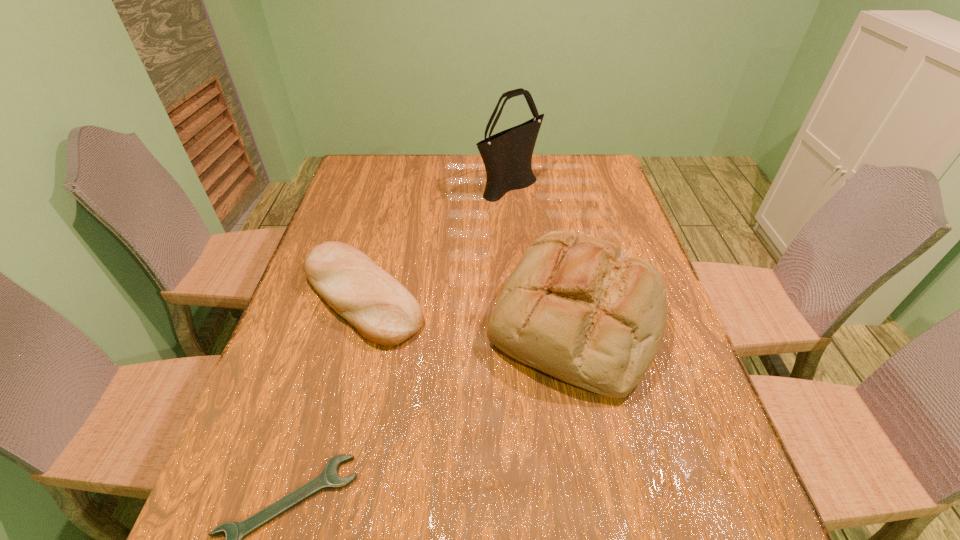
Image resolution: width=960 pixels, height=540 pixels. I want to click on object at the left edge, so click(x=384, y=312).

Where is `object at the right edge`? object at the right edge is located at coordinates (576, 307).

In the image, there is a desktop. Where is `vacant space at the far edge`? The height and width of the screenshot is (540, 960). vacant space at the far edge is located at coordinates (463, 183).

Identify the location of blank space at the left edge. Image resolution: width=960 pixels, height=540 pixels. (252, 485).

Identify the location of free space at the right edge of the desktop. This screenshot has width=960, height=540. (673, 451).

Locate an element on the screen. The image size is (960, 540). vacant area that lies between the left bread and the second tallest object is located at coordinates (468, 307).

Where is `free space between the right bread and the shorter bread`? This screenshot has height=540, width=960. free space between the right bread and the shorter bread is located at coordinates (468, 307).

Identify which object is the closest to the second shortest object. Please provide its 2D coordinates. Your answer should be formatted as a tuple, i.e. [(x, y)], where the tuple contains the x and y coordinates of a point satisfying the conditions above.

[(576, 307)]

Where is `object that is the second closest to the wrench`? object that is the second closest to the wrench is located at coordinates point(576,307).